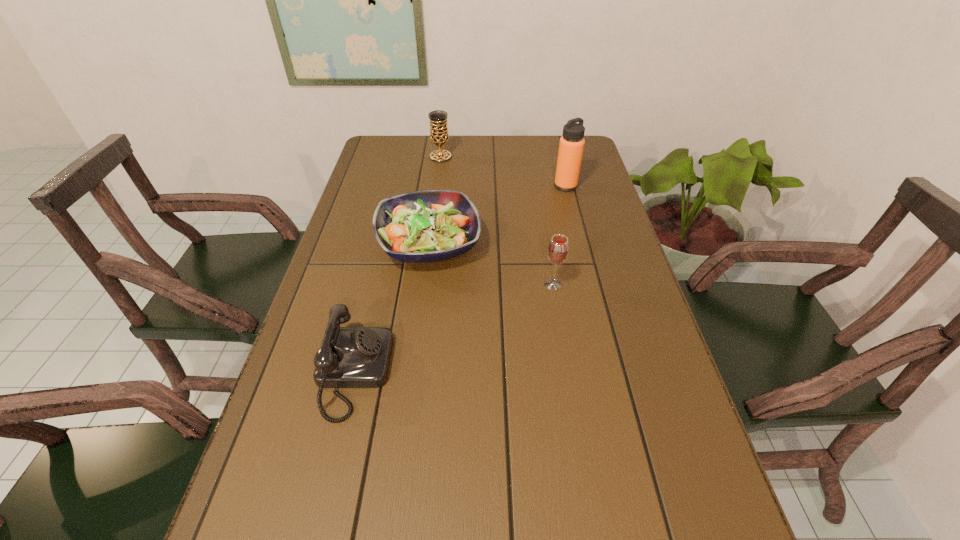
Locate an element on the screen. Image resolution: width=960 pixels, height=540 pixels. the rightmost object is located at coordinates (571, 145).

At what (x,y) coordinates should I click in order to perform the action: click on thermos bottle. Please return your answer as a coordinate pair (x, y). This screenshot has height=540, width=960. Looking at the image, I should click on (571, 145).

The image size is (960, 540). Find the location of `chalice`. chalice is located at coordinates (439, 135).

Identify the location of the fourth object from left to right. (558, 249).

Identify the location of salad plate. (425, 226).

Image resolution: width=960 pixels, height=540 pixels. In order to click on the nearest object in this screenshot , I will do `click(349, 357)`.

This screenshot has height=540, width=960. I want to click on free space located on the left of the thermos bottle, so click(x=464, y=186).

Find the location of a particular element. This screenshot has height=540, width=960. free space located on the right of the farthest object is located at coordinates (532, 157).

You are a GUI agent. You are given a task and a screenshot of the screen. Output one action in this format:
    pyautogui.click(x=<x>, y=<y>)
    Task: Click on the free space located on the front of the second object from right to left
    This screenshot has width=960, height=540.
    Given the screenshot: What is the action you would take?
    pyautogui.click(x=557, y=310)

The height and width of the screenshot is (540, 960). In order to click on blank area located 0.170m on the back of the salad plate in this screenshot , I will do `click(437, 184)`.